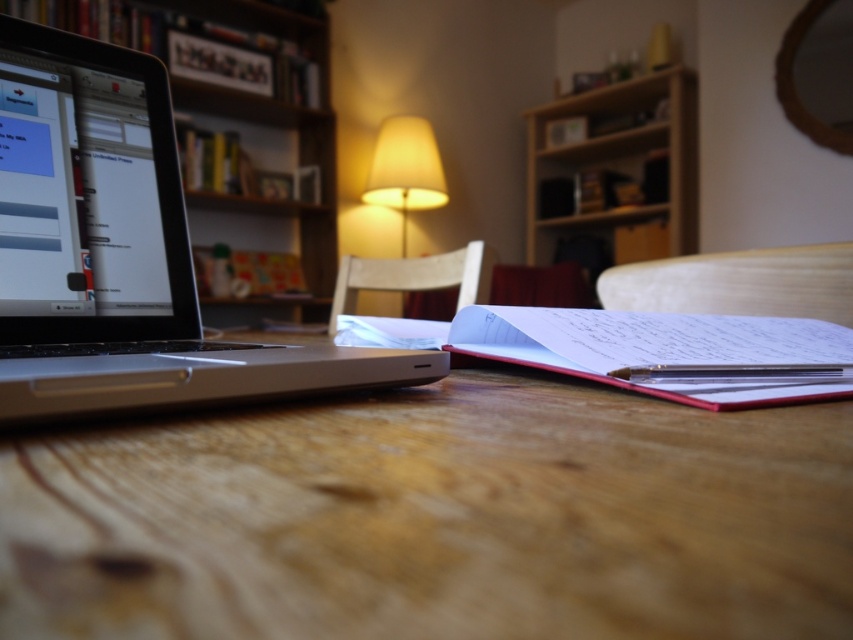
Question: Which of the following is the farthest from the observer?

Choices:
 (A) (503, 355)
 (B) (590, 403)
 (C) (129, 125)
 (D) (422, 156)

Answer: (D)

Question: Which point appears farthest from the camera in this image?

Choices:
 (A) (668, 131)
 (B) (416, 141)
 (C) (119, 310)
 (D) (657, 346)

Answer: (A)

Question: Observing the image, what is the correct spatial positioning of silver metallic laptop at left in reference to wooden bookshelf at upper center?

Choices:
 (A) below
 (B) above

Answer: (A)

Question: Is white paper notebook at center thinner than matte yellow lampshade at center?

Choices:
 (A) no
 (B) yes

Answer: (A)

Question: Which point is farther to the camera?

Choices:
 (A) white paper notebook at center
 (B) matte yellow lampshade at center

Answer: (B)

Question: Does white paper notebook at center lie in front of wooden bookshelf at upper center?

Choices:
 (A) no
 (B) yes

Answer: (B)